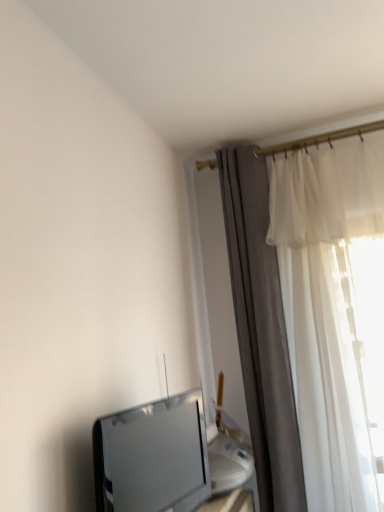
Measure the distance between silky white curtain at right and camera.

They are 5.90 feet apart.

The image size is (384, 512). Identify the location of silky white curtain at right. (261, 331).

What do you see at coordinates (261, 331) in the screenshot? I see `silky white curtain at right` at bounding box center [261, 331].

Measure the distance between point (x=253, y=448) and camera.

Point (x=253, y=448) and camera are 1.86 meters apart from each other.

Measure the distance between point (191, 407) and camera.

Point (191, 407) is 4.63 feet away from camera.

Where is `matte silver tv at lower left`? matte silver tv at lower left is located at coordinates (152, 457).

Describe the element at coordinates (152, 457) in the screenshot. I see `matte silver tv at lower left` at that location.

You are a GUI agent. You are given a task and a screenshot of the screen. Output one action in this format:
    pyautogui.click(x=<x>, y=<y>)
    Task: Click on the silky white curtain at right
    The height and width of the screenshot is (512, 384).
    Given the screenshot: What is the action you would take?
    pyautogui.click(x=261, y=331)

In the scene shown: Can you confirm if silky white curtain at right is positioned to the right of matte silver tv at lower left?

Correct, you'll find silky white curtain at right to the right of matte silver tv at lower left.

Who is more distant, silky white curtain at right or matte silver tv at lower left?

Positioned behind is silky white curtain at right.

Does point (226, 179) come behind point (126, 442)?

Yes, point (226, 179) is farther from viewer.

From the image's perspective, is silky white curtain at right on matte silver tv at lower left?

Yes, from the image's perspective, silky white curtain at right is over matte silver tv at lower left.

From a real-world perspective, is silky white curtain at right located higher than matte silver tv at lower left?

Yes, from a real-world perspective, silky white curtain at right is on top of matte silver tv at lower left.

Does silky white curtain at right have a lesser width compared to matte silver tv at lower left?

No.

In terms of height, does silky white curtain at right look taller or shorter compared to matte silver tv at lower left?

Clearly, silky white curtain at right is taller compared to matte silver tv at lower left.

Who is bigger, silky white curtain at right or matte silver tv at lower left?

silky white curtain at right.

Can we say silky white curtain at right lies outside matte silver tv at lower left?

Yes.

Is the surface of silky white curtain at right in direct contact with matte silver tv at lower left?

silky white curtain at right is not next to matte silver tv at lower left, and they're not touching.

Could you tell me if silky white curtain at right is facing matte silver tv at lower left?

Yes, silky white curtain at right is facing matte silver tv at lower left.

The image size is (384, 512). There is a matte silver tv at lower left. Find the location of `curtain above it (from a real-world perspective)`. curtain above it (from a real-world perspective) is located at coordinates (261, 331).

Does matte silver tv at lower left appear on the left side of silky white curtain at right?

Yes, matte silver tv at lower left is to the left of silky white curtain at right.

Relative to silky white curtain at right, is matte silver tv at lower left in front or behind?

matte silver tv at lower left is in front of silky white curtain at right.

From the picture: Which is nearer, (96, 504) or (273, 347)?

The point (96, 504) is more forward.

From the image's perspective, is matte silver tv at lower left above silky white curtain at right?

No, from the image's perspective, matte silver tv at lower left is not above silky white curtain at right.

From a real-world perspective, is matte silver tv at lower left above or below silky white curtain at right?

Clearly, from a real-world perspective, matte silver tv at lower left is below silky white curtain at right.

Considering the relative sizes of matte silver tv at lower left and silky white curtain at right in the image provided, is matte silver tv at lower left wider than silky white curtain at right?

No.

Consider the image. Considering the sizes of objects matte silver tv at lower left and silky white curtain at right in the image provided, who is taller, matte silver tv at lower left or silky white curtain at right?

Standing taller between the two is silky white curtain at right.

Between matte silver tv at lower left and silky white curtain at right, which one has smaller size?

Smaller between the two is matte silver tv at lower left.

Does matte silver tv at lower left contain silky white curtain at right?

Actually, silky white curtain at right is outside matte silver tv at lower left.

Is matte silver tv at lower left directly adjacent to silky white curtain at right?

No, matte silver tv at lower left is not in contact with silky white curtain at right.

Does matte silver tv at lower left turn towards silky white curtain at right?

No, matte silver tv at lower left is not turned towards silky white curtain at right.

How different are the orientations of matte silver tv at lower left and silky white curtain at right in degrees?

There is a 77.5-degree angle between the facing directions of matte silver tv at lower left and silky white curtain at right.

Where is `curtain above the matte silver tv at lower left (from the image's perspective)`? The image size is (384, 512). curtain above the matte silver tv at lower left (from the image's perspective) is located at coordinates (261, 331).

Image resolution: width=384 pixels, height=512 pixels. What are the coordinates of `curtain above the matte silver tv at lower left (from a real-world perspective)` in the screenshot? It's located at (261, 331).

In order to click on television directly beneath the silky white curtain at right (from a real-world perspective) in this screenshot , I will do `click(152, 457)`.